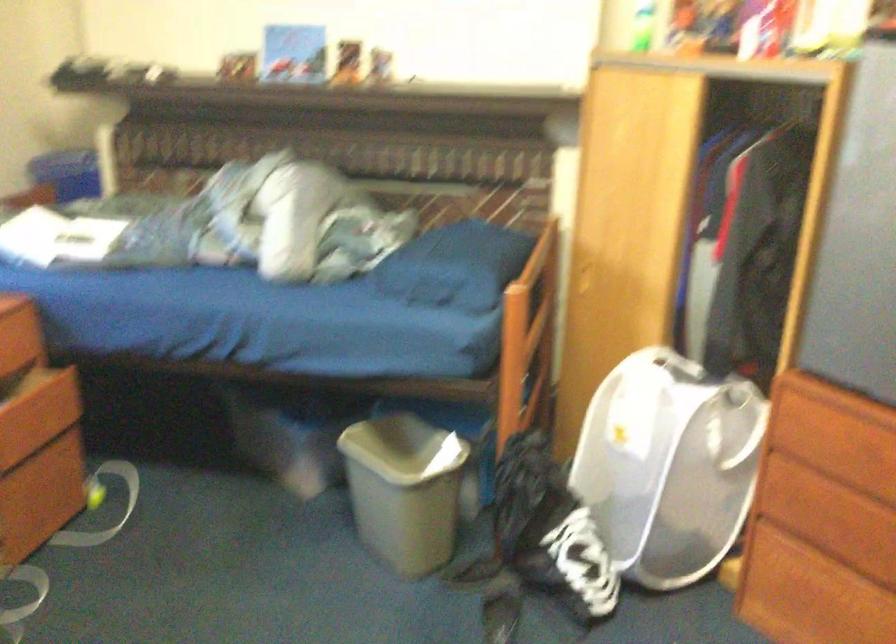
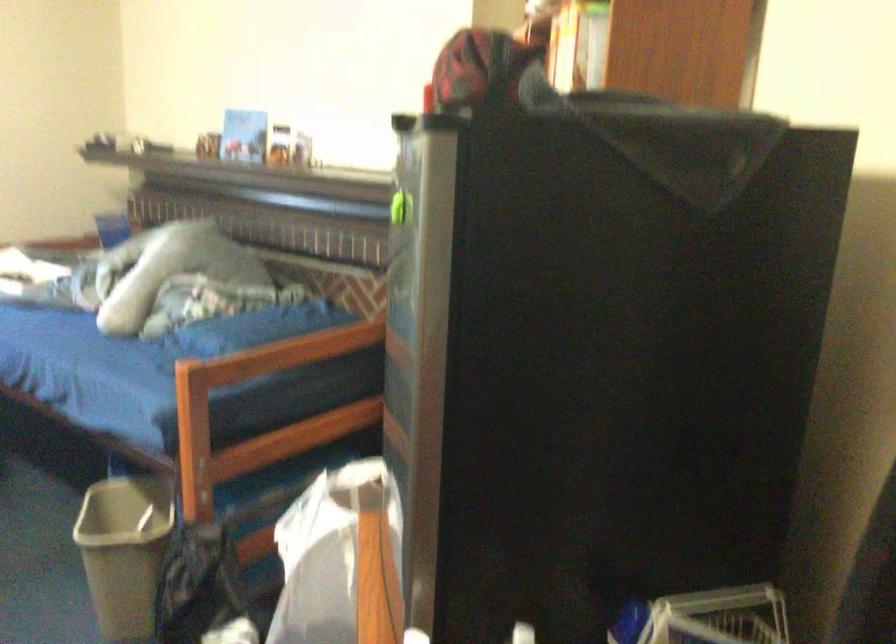
Question: I am providing you with two images of the same scene from different viewpoints. Please identify which objects are invisible in image2.

Choices:
 (A) white wire basket
 (B) red and black cap
 (C) wardrobe door
 (D) green wall dispenser

Answer: (C)